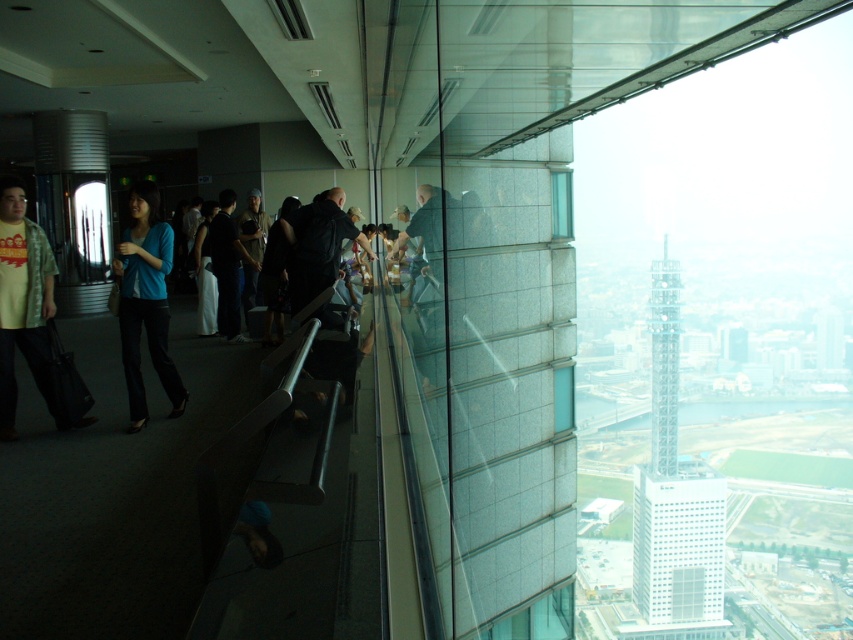
You are standing inside the high rise building and want to take a photo of the transparent glass tower at right through the clear glass window at upper right. Can you do so without any obstruction?

The transparent glass tower at right is to the right of the clear glass window at upper right, so you can take the photo without obstruction as the tower is positioned outside the window.

You are standing at the observation deck and want to take a photo of the white glass tower at upper right while including the dark blue jacket at center in the frame. Given that your camera has a maximum zoom range of 1000 meters, will you be able to capture both subjects in a single photo?

The white glass tower at upper right and dark blue jacket at center are 597.98 meters apart. Since your camera can zoom up to 1000 meters, you can capture both subjects in a single photo as the distance between them is within the camera range.

You are standing on an observation deck and want to take a photo of the transparent glass tower at right. If your camera has a maximum zoom range of 500 meters, will you need to move closer to capture the tower clearly?

The transparent glass tower at right is 654.16 meters away from the camera. Since your camera can only zoom up to 500 meters, you will need to move closer to ensure the tower is in focus and clear.